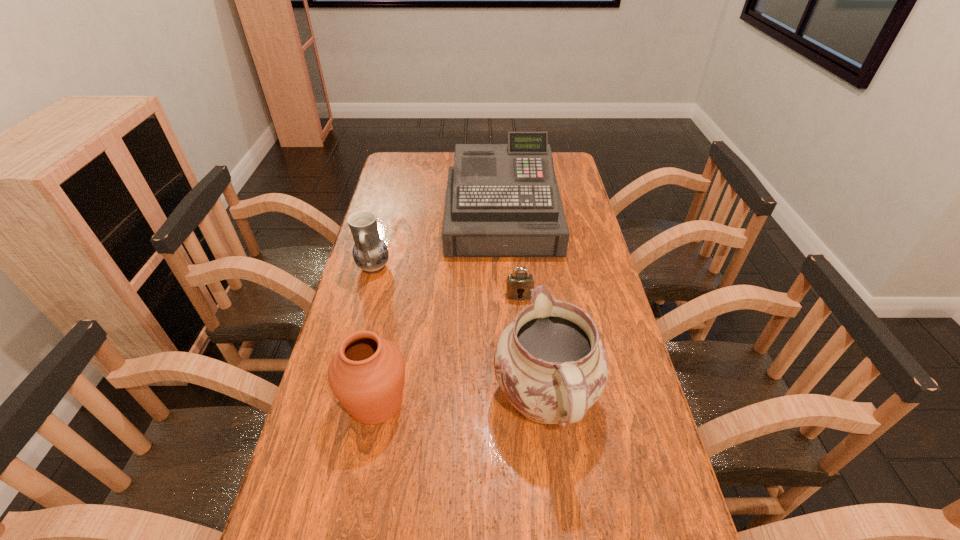
Find the location of a particular element. This screenshot has width=960, height=540. free space between the padlock and the cash register is located at coordinates (511, 257).

The image size is (960, 540). Identify the location of vacant space in between the padlock and the pottery. (446, 281).

Identify the location of free spot between the pitcher and the urn. The width and height of the screenshot is (960, 540). (461, 401).

Identify the location of vacant area between the pottery and the cash register. (438, 244).

I want to click on the fourth closest object relative to the pitcher, so click(370, 253).

Locate an element on the screen. This screenshot has width=960, height=540. object that is the third closest to the pitcher is located at coordinates (502, 200).